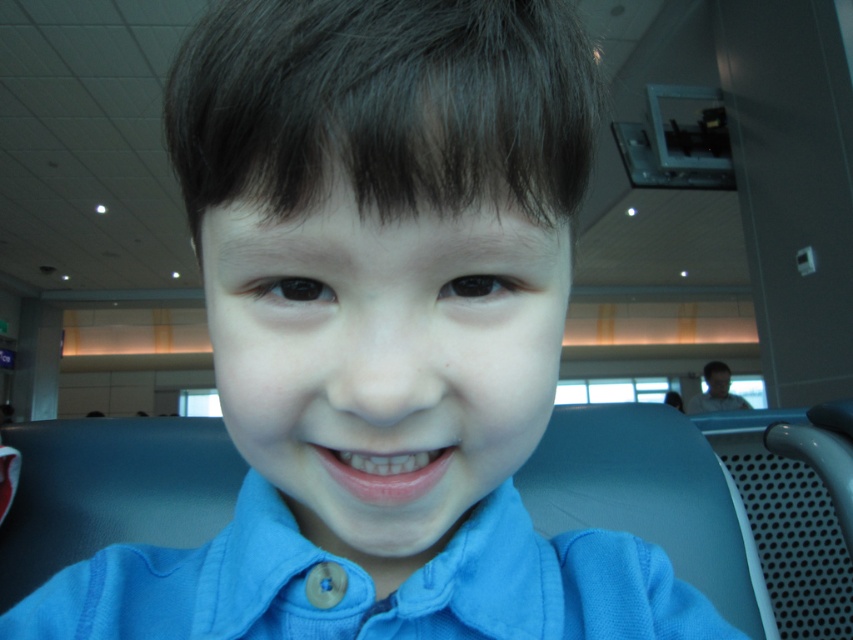
Can you confirm if blue cotton dress shirt at center is wider than matte black face at upper right?

No.

Who is more forward, (169,605) or (701,401)?

Point (169,605)

Locate an element on the screen. This screenshot has height=640, width=853. blue cotton dress shirt at center is located at coordinates (373, 586).